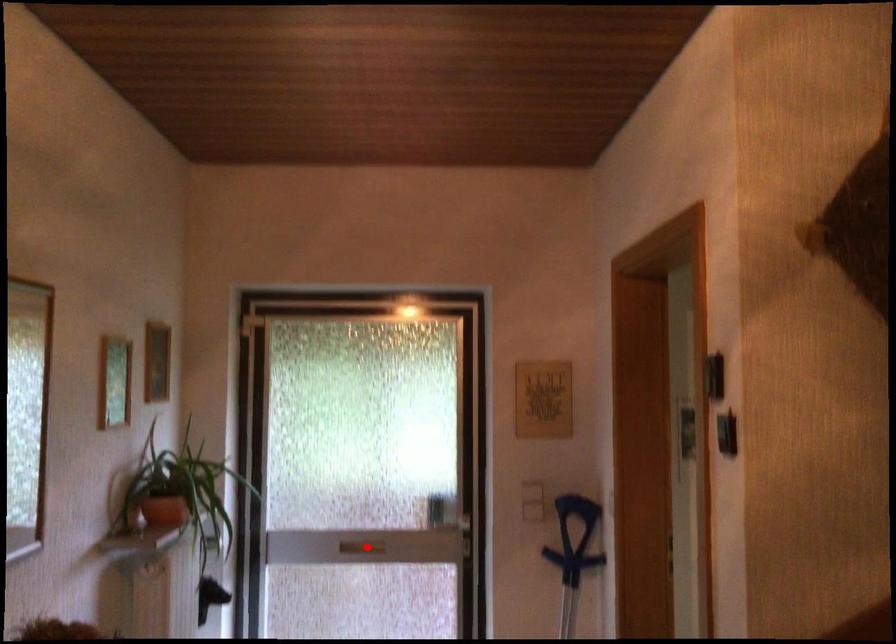
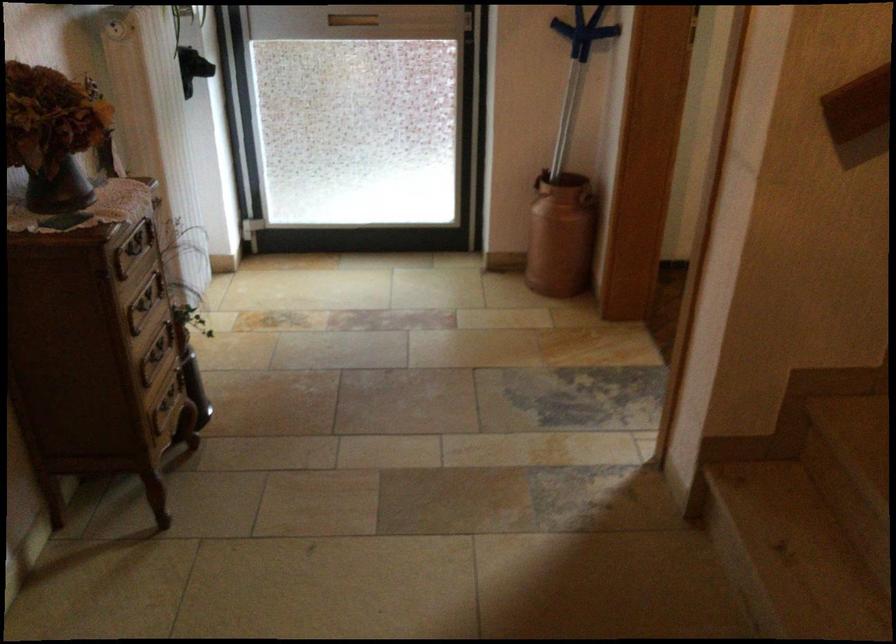
Where in the second image is the point corresponding to the highlighted location from the first image?

(352, 20)